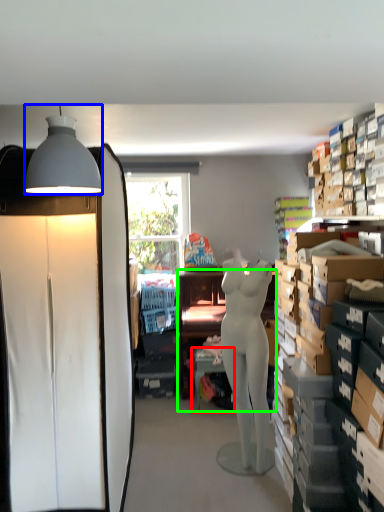
Question: Estimate the real-world distances between objects in this image. Which object is closer to table (highlighted by a red box), lamp (highlighted by a blue box) or desk (highlighted by a green box)?

Choices:
 (A) lamp
 (B) desk

Answer: (B)